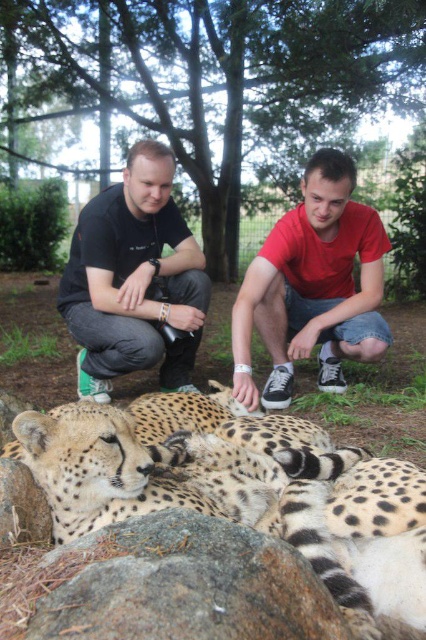
You are a photographer standing at the edge of the sanctuary. You want to take a photo that includes both the gray rough rock at lower center and the black matte shirt at center. Which object should you focus on first to ensure both are in sharp focus?

The gray rough rock at lower center is closer to the viewer than the black matte shirt at center. To ensure both are in sharp focus, focus on the gray rough rock at lower center first since it is closer, and the black matte shirt at center will naturally fall into the depth of field if the focus is set correctly on the closer object.

You are a wildlife photographer aiming to capture a clear photo of the spotted fur cheetah at center without any obstructions. Based on the scene, is the gray rough rock at lower center blocking your view of the cheetah?

The gray rough rock at lower center is behind the spotted fur cheetah at center, so it does not block the view of the cheetah. You can take the photo without any obstruction.